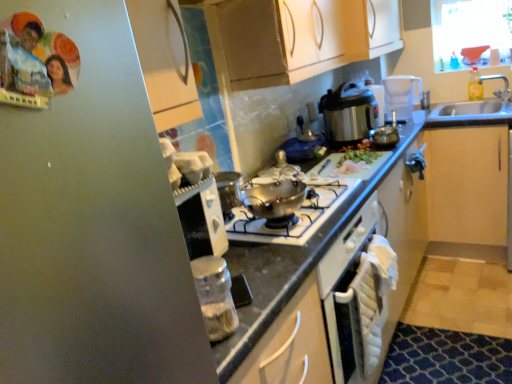
Question: Do you think stainless steel pressure cooker at upper right, the 1th kitchen appliance from the back, is within black granite countertop at center, or outside of it?

Choices:
 (A) inside
 (B) outside

Answer: (B)

Question: In the image, is stainless steel pressure cooker at upper right, the 1th kitchen appliance from the back, positioned in front of or behind black granite countertop at center?

Choices:
 (A) front
 (B) behind

Answer: (B)

Question: Which object is positioned farthest from the stainless steel pressure cooker at upper right, the 2th kitchen appliance ordered from the bottom?

Choices:
 (A) black granite countertop at center
 (B) clear glass jar at lower center, the second kitchen appliance from the right
 (C) shiny metallic pot at center
 (D) clear plastic bottle at upper right
 (E) light wood cabinet at right

Answer: (B)

Question: Which of these objects is positioned farthest from the clear plastic bottle at upper right?

Choices:
 (A) black granite countertop at center
 (B) light wood cabinet at right
 (C) shiny metallic pot at center
 (D) stainless steel pressure cooker at upper right, the 1th kitchen appliance from the back
 (E) clear glass jar at lower center, the first kitchen appliance positioned from the left

Answer: (E)